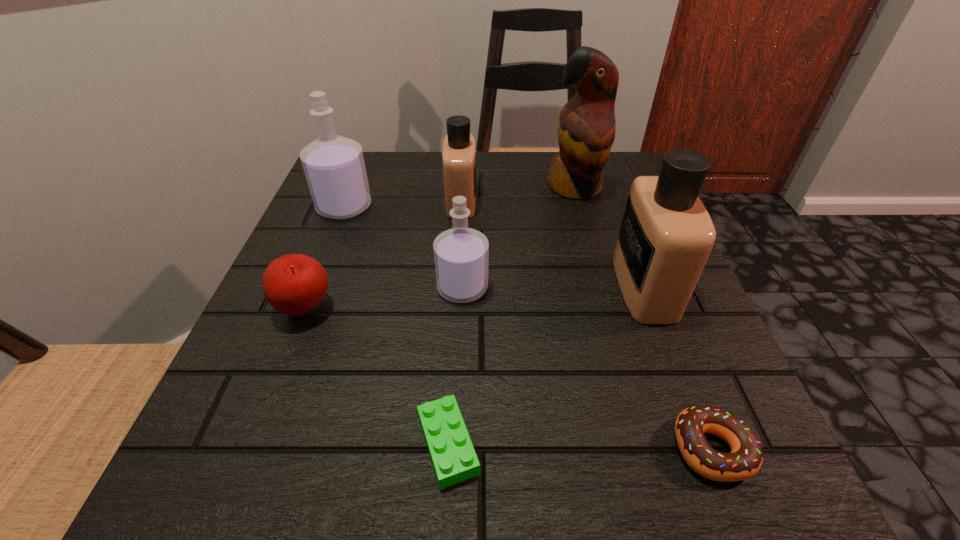
Locate an element on the screen. apple located at the left edge is located at coordinates (295, 284).

Locate an element on the screen. Image resolution: width=960 pixels, height=540 pixels. parrot that is at the right edge is located at coordinates (586, 127).

Locate an element on the screen. This screenshot has width=960, height=540. perfume that is at the right edge is located at coordinates (666, 236).

This screenshot has height=540, width=960. I want to click on doughnut present at the right edge, so click(x=745, y=460).

Identify the location of object located at the far left corner. This screenshot has width=960, height=540. (334, 166).

The image size is (960, 540). Identify the location of object present at the far right corner. (586, 127).

The width and height of the screenshot is (960, 540). In order to click on object positioned at the near right corner in this screenshot , I will do `click(745, 460)`.

Locate an element on the screen. The image size is (960, 540). free point at the far edge is located at coordinates (502, 191).

Identify the location of vacant space at the near edge. This screenshot has width=960, height=540. (438, 507).

What are the coordinates of `vacant area at the left edge` in the screenshot? It's located at (228, 441).